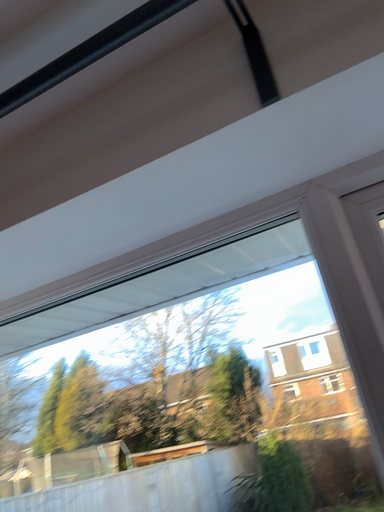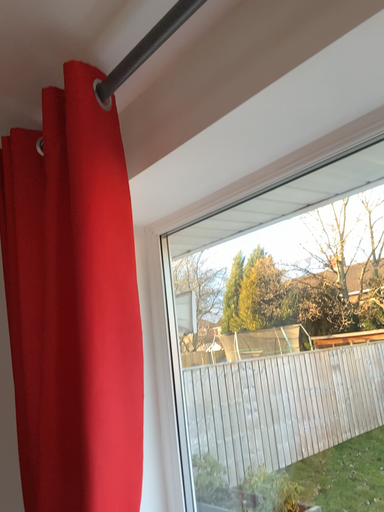
Question: Which way did the camera rotate in the video?

Choices:
 (A) rotated downward
 (B) rotated upward

Answer: (A)